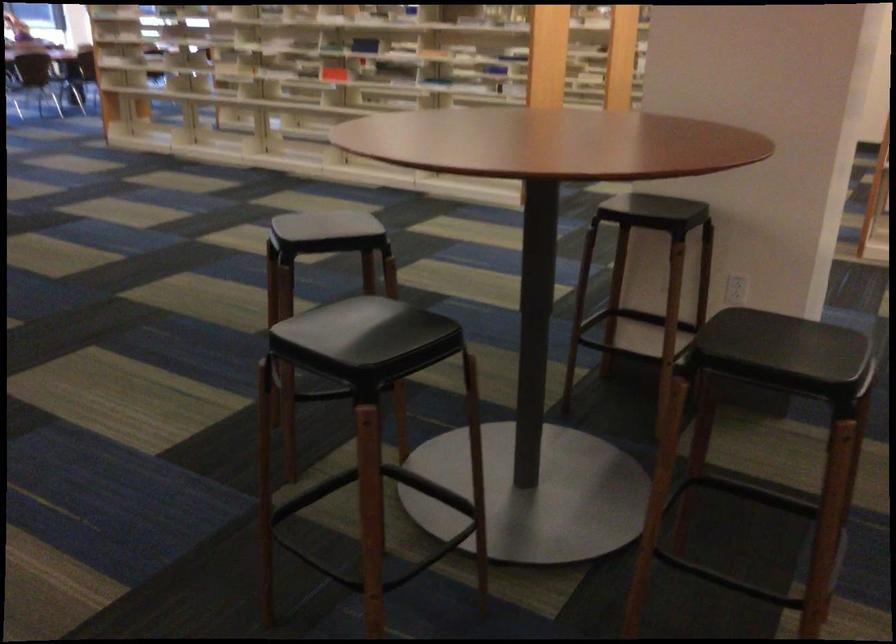
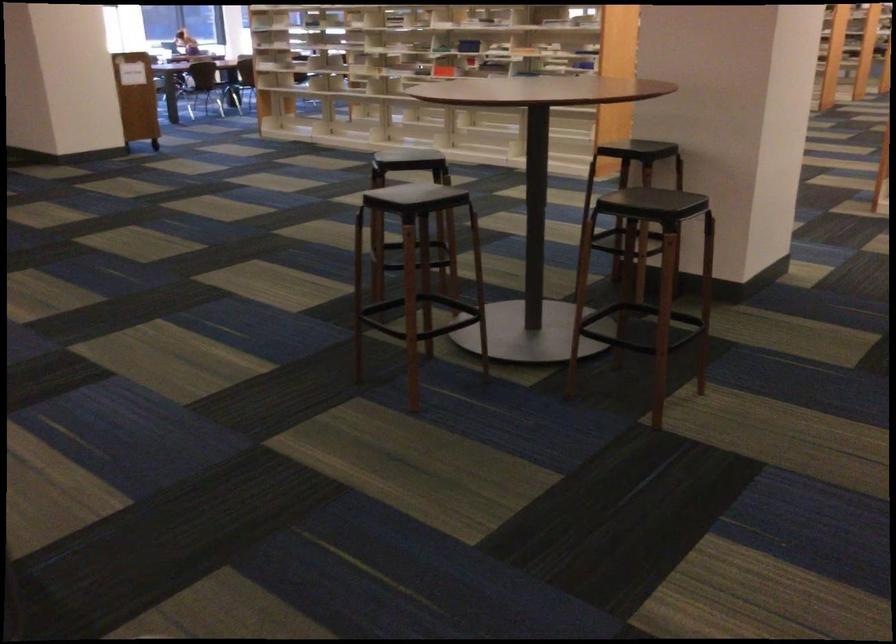
Find the pixel in the second image that matches point (350, 84) in the first image.

(443, 71)